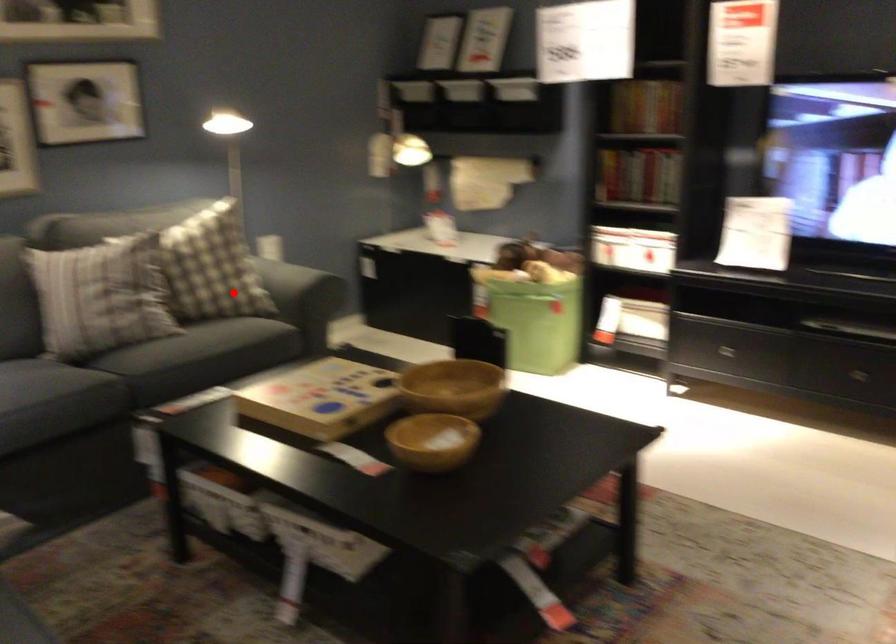
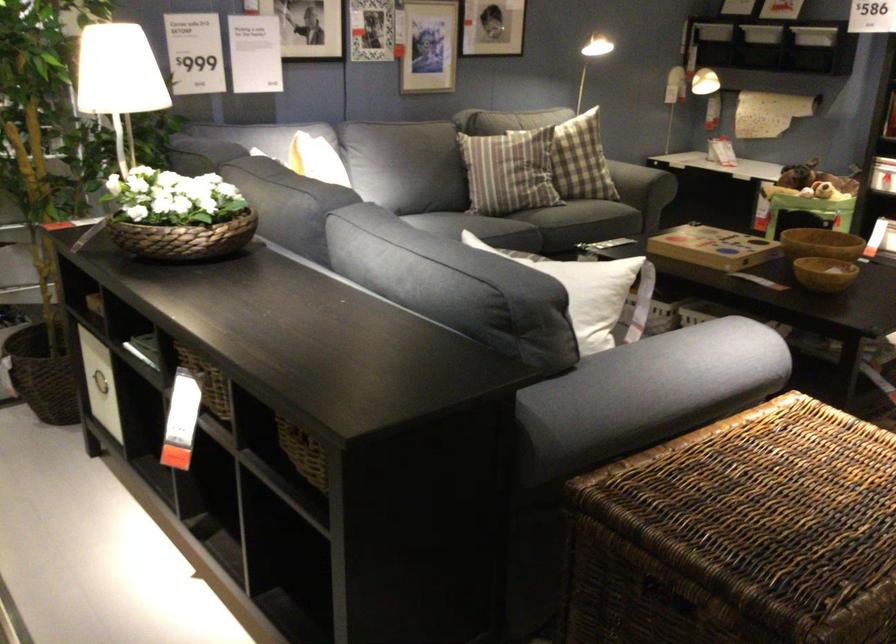
Question: I am providing you with two images of the same scene from different viewpoints. In image1, a red point is highlighted. Considering the same 3D point in image2, which of the following is correct?

Choices:
 (A) It is closer
 (B) It is farther

Answer: (B)